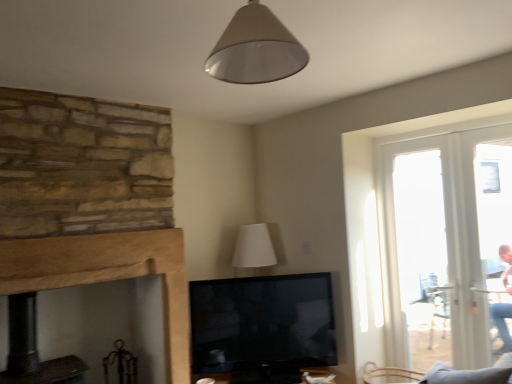
Question: From the image's perspective, is wooden mantle at center over matte beige cone at upper center?

Choices:
 (A) yes
 (B) no

Answer: (B)

Question: From a real-world perspective, is wooden mantle at center below matte beige cone at upper center?

Choices:
 (A) yes
 (B) no

Answer: (A)

Question: Can you confirm if wooden mantle at center is shorter than matte beige cone at upper center?

Choices:
 (A) yes
 (B) no

Answer: (B)

Question: Is wooden mantle at center at the right side of matte beige cone at upper center?

Choices:
 (A) no
 (B) yes

Answer: (A)

Question: Does wooden mantle at center lie in front of matte beige cone at upper center?

Choices:
 (A) no
 (B) yes

Answer: (A)

Question: Would you say wooden mantle at center is a long distance from matte beige cone at upper center?

Choices:
 (A) yes
 (B) no

Answer: (A)

Question: Is matte beige cone at upper center shorter than wooden mantle at center?

Choices:
 (A) yes
 (B) no

Answer: (A)

Question: From a real-world perspective, is matte beige cone at upper center beneath wooden mantle at center?

Choices:
 (A) no
 (B) yes

Answer: (A)

Question: From the image's perspective, would you say matte beige cone at upper center is shown under wooden mantle at center?

Choices:
 (A) yes
 (B) no

Answer: (B)

Question: Could you tell me if matte beige cone at upper center is facing wooden mantle at center?

Choices:
 (A) yes
 (B) no

Answer: (B)

Question: Is matte beige cone at upper center positioned beyond the bounds of wooden mantle at center?

Choices:
 (A) yes
 (B) no

Answer: (A)

Question: Is matte beige cone at upper center far from wooden mantle at center?

Choices:
 (A) no
 (B) yes

Answer: (B)

Question: Considering the positions of wooden mantle at center and matte beige cone at upper center in the image, is wooden mantle at center bigger or smaller than matte beige cone at upper center?

Choices:
 (A) big
 (B) small

Answer: (A)